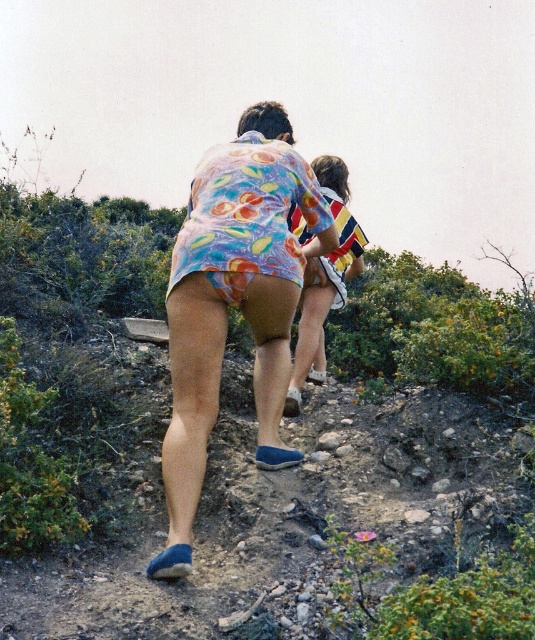
Question: Among these objects, which one is farthest from the camera?

Choices:
 (A) striped fabric shirt at upper center
 (B) floral fabric shorts at center

Answer: (A)

Question: In this image, where is floral fabric shorts at center located relative to striped fabric shirt at upper center?

Choices:
 (A) above
 (B) below

Answer: (B)

Question: Does floral fabric shorts at center have a larger size compared to striped fabric shirt at upper center?

Choices:
 (A) yes
 (B) no

Answer: (A)

Question: Is floral fabric shorts at center above striped fabric shirt at upper center?

Choices:
 (A) no
 (B) yes

Answer: (A)

Question: Among these points, which one is farthest from the camera?

Choices:
 (A) (312, 372)
 (B) (309, 168)

Answer: (A)